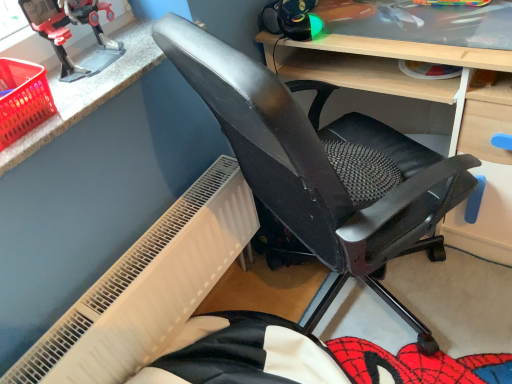
Question: From the image's perspective, is white textured radiator at lower left located above or below metallic plastic toy robot at upper left?

Choices:
 (A) below
 (B) above

Answer: (A)

Question: From a real-world perspective, relative to metallic plastic toy robot at upper left, is white textured radiator at lower left vertically above or below?

Choices:
 (A) below
 (B) above

Answer: (A)

Question: Based on their relative distances, which object is farther from the metallic plastic toy robot at upper left?

Choices:
 (A) red plastic basket at upper left
 (B) black mesh chair at center
 (C) white textured radiator at lower left
 (D) matte black chair at center

Answer: (D)

Question: Which object is positioned closest to the matte black chair at center?

Choices:
 (A) metallic plastic toy robot at upper left
 (B) white textured radiator at lower left
 (C) red plastic basket at upper left
 (D) black mesh chair at center

Answer: (D)